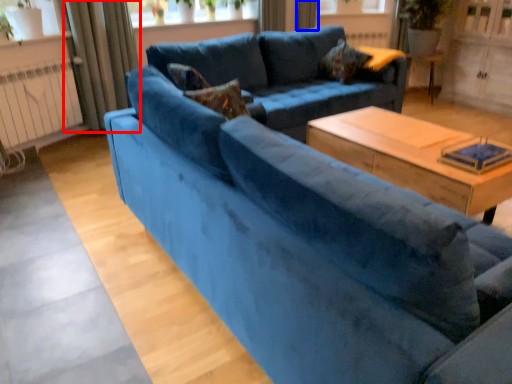
Question: Which object appears farthest to the camera in this image, curtain (highlighted by a red box) or curtain (highlighted by a blue box)?

Choices:
 (A) curtain
 (B) curtain

Answer: (B)